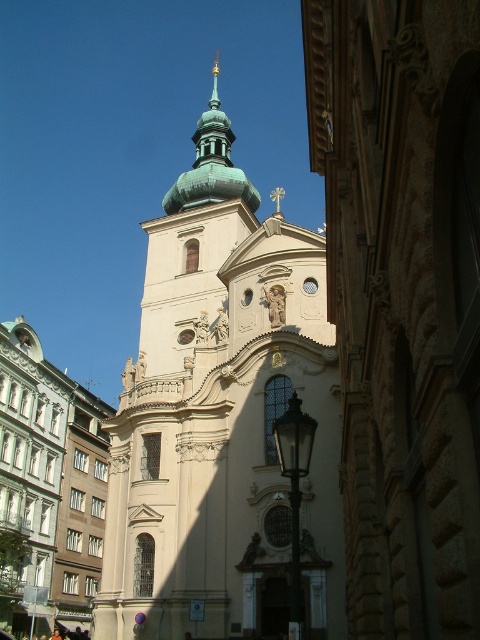
Question: Which object is the closest to the green polished stone spire at upper center?

Choices:
 (A) green polished spire at upper center
 (B) light beige stone church at center

Answer: (A)

Question: Considering the real-world distances, which object is closest to the green polished spire at upper center?

Choices:
 (A) green polished stone spire at upper center
 (B) beige stone tower at center
 (C) light beige stone church at center

Answer: (A)

Question: Is beige stone tower at center in front of green polished stone spire at upper center?

Choices:
 (A) no
 (B) yes

Answer: (B)

Question: Which point is farther from the camera taking this photo?

Choices:
 (A) (212, 68)
 (B) (163, 209)
 (C) (271, 358)
 (D) (68, 381)

Answer: (A)

Question: Can you confirm if beige stone tower at center is thinner than green polished stone spire at upper center?

Choices:
 (A) no
 (B) yes

Answer: (A)

Question: Can you confirm if beige stone tower at center is positioned below light beige stone church at center?

Choices:
 (A) no
 (B) yes

Answer: (A)